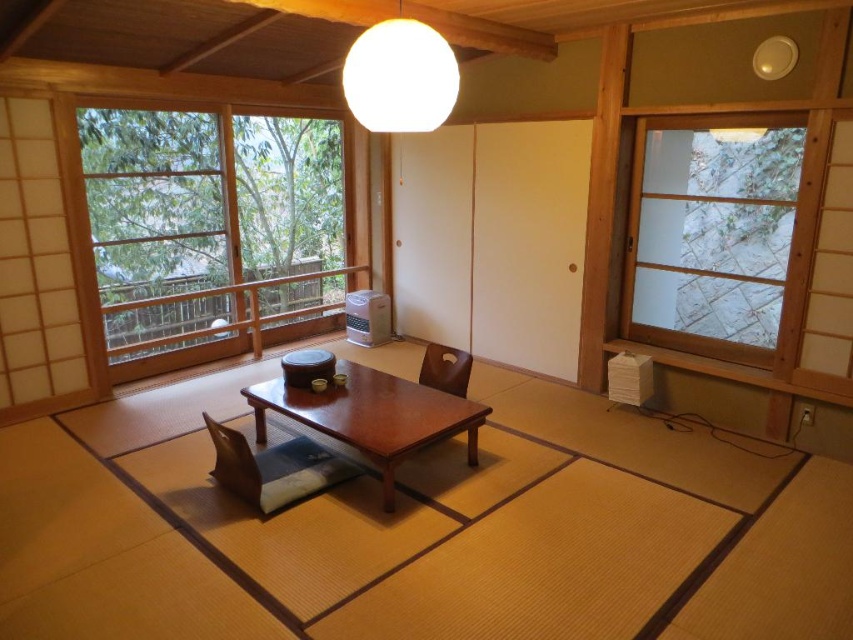
You are standing in the traditional Japanese room and want to take a photo of the transparent glass sliding door at right. Your camera is 11.40 feet away from the door. Is the distance sufficient to capture the entire door in one frame?

The transparent glass sliding door at right and camera are 11.40 feet apart from each other, so the distance of 11.40 feet is sufficient to capture the entire door in one frame if the camera has an appropriate lens or zoom capability. However, this depends on the camera specifications and the size of the door.

You are a delivery person who needs to place a package on the table in the Japanese room. The package is 5.6 feet long. Can you slide the white matte sphere at upper center away from the wooden chair at center to make space?

The distance between the white matte sphere at upper center and the wooden chair at center is 5.69 feet. Since the package is 5.6 feet long, which is slightly shorter than the available space, you can slide the white matte sphere at upper center away from the wooden chair at center to create enough space for the package.